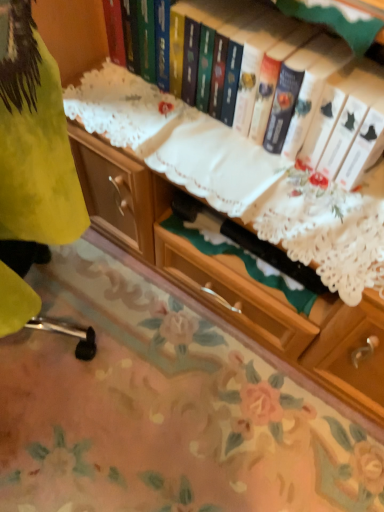
What do you see at coordinates (301, 89) in the screenshot?
I see `hardcover book at upper center` at bounding box center [301, 89].

The height and width of the screenshot is (512, 384). Identify the location of hardcover book at upper center. pyautogui.click(x=301, y=89).

Where is `floral-patterned fabric at lower center`? floral-patterned fabric at lower center is located at coordinates (163, 409).

This screenshot has height=512, width=384. What do you see at coordinates (163, 409) in the screenshot?
I see `floral-patterned fabric at lower center` at bounding box center [163, 409].

Where is `hardcover book at upper center`? The width and height of the screenshot is (384, 512). hardcover book at upper center is located at coordinates (301, 89).

Can you confirm if floral-patterned fabric at lower center is positioned to the right of hardcover book at upper center?

No, floral-patterned fabric at lower center is not to the right of hardcover book at upper center.

Looking at this image, does floral-patterned fabric at lower center come in front of hardcover book at upper center?

No, the depth of floral-patterned fabric at lower center is greater than that of hardcover book at upper center.

Does point (237, 470) come in front of point (284, 40)?

That is False.

From the image's perspective, which is below, floral-patterned fabric at lower center or hardcover book at upper center?

floral-patterned fabric at lower center.

From a real-world perspective, is floral-patterned fabric at lower center located beneath hardcover book at upper center?

Yes, from a real-world perspective, floral-patterned fabric at lower center is below hardcover book at upper center.

Which object is thinner, floral-patterned fabric at lower center or hardcover book at upper center?

hardcover book at upper center.

Who is taller, floral-patterned fabric at lower center or hardcover book at upper center?

Standing taller between the two is hardcover book at upper center.

Can you confirm if floral-patterned fabric at lower center is smaller than hardcover book at upper center?

Actually, floral-patterned fabric at lower center might be larger than hardcover book at upper center.

Is hardcover book at upper center a part of floral-patterned fabric at lower center?

Definitely not — hardcover book at upper center is not inside floral-patterned fabric at lower center.

Can you see floral-patterned fabric at lower center touching hardcover book at upper center?

No, floral-patterned fabric at lower center is not in contact with hardcover book at upper center.

Is floral-patterned fabric at lower center turned away from hardcover book at upper center?

That's not correct — floral-patterned fabric at lower center is not looking away from hardcover book at upper center.

What's the angular difference between floral-patterned fabric at lower center and hardcover book at upper center's facing directions?

floral-patterned fabric at lower center and hardcover book at upper center are facing 92.3 degrees away from each other.

Measure the distance from floral-patterned fabric at lower center to hardcover book at upper center.

73.16 centimeters.

Locate an element on the screen. tablecloth that is on the left side of hardcover book at upper center is located at coordinates (163, 409).

Is hardcover book at upper center to the left of floral-patterned fabric at lower center from the viewer's perspective?

No.

From the picture: Which object is closer to the camera, hardcover book at upper center or floral-patterned fabric at lower center?

Positioned in front is hardcover book at upper center.

Does point (273, 62) appear closer or farther from the camera than point (22, 346)?

Point (273, 62).

From the image's perspective, between hardcover book at upper center and floral-patterned fabric at lower center, who is located below?

floral-patterned fabric at lower center appears lower in the image.

From a real-world perspective, between hardcover book at upper center and floral-patterned fabric at lower center, who is vertically higher?

hardcover book at upper center, from a real-world perspective.

Between hardcover book at upper center and floral-patterned fabric at lower center, which one has smaller width?

With smaller width is hardcover book at upper center.

Considering the relative sizes of hardcover book at upper center and floral-patterned fabric at lower center in the image provided, is hardcover book at upper center taller than floral-patterned fabric at lower center?

Indeed, hardcover book at upper center has a greater height compared to floral-patterned fabric at lower center.

Based on their sizes in the image, would you say hardcover book at upper center is bigger or smaller than floral-patterned fabric at lower center?

Clearly, hardcover book at upper center is smaller in size than floral-patterned fabric at lower center.

From the picture: Is floral-patterned fabric at lower center located within hardcover book at upper center?

No, floral-patterned fabric at lower center is located outside of hardcover book at upper center.

Is hardcover book at upper center not close to floral-patterned fabric at lower center?

hardcover book at upper center is near floral-patterned fabric at lower center, not far away.

Could you tell me if hardcover book at upper center is facing floral-patterned fabric at lower center?

No, hardcover book at upper center is not oriented towards floral-patterned fabric at lower center.

Identify the location of tablecloth behind the hardcover book at upper center. The width and height of the screenshot is (384, 512). (163, 409).

You are a GUI agent. You are given a task and a screenshot of the screen. Output one action in this format:
    pyautogui.click(x=<x>, y=<y>)
    Task: Click on the tablecloth below the hardcover book at upper center (from a real-world perspective)
    This screenshot has height=512, width=384.
    Given the screenshot: What is the action you would take?
    pyautogui.click(x=163, y=409)

At what (x,y) coordinates should I click in order to perform the action: click on book that is above the floral-patterned fabric at lower center (from the image's perspective). Please return your answer as a coordinate pair (x, y). The image size is (384, 512). Looking at the image, I should click on (301, 89).